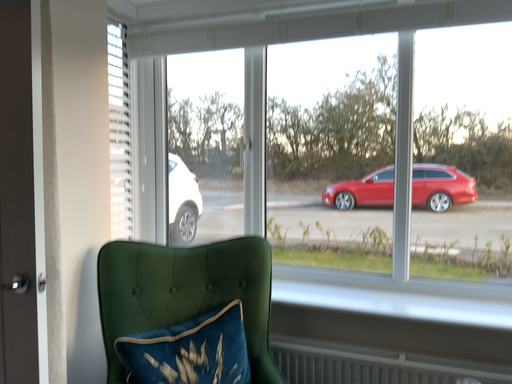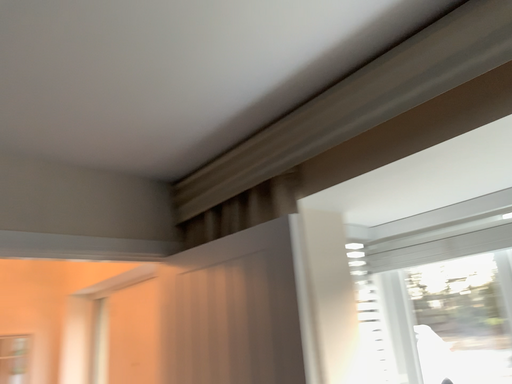
Question: Which way did the camera rotate in the video?

Choices:
 (A) rotated downward
 (B) rotated upward

Answer: (B)